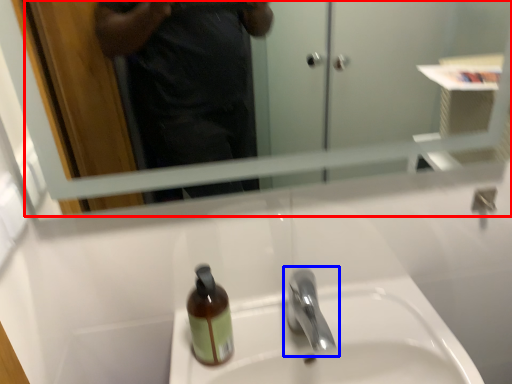
Question: Which point is further to the camera, mirror (highlighted by a red box) or tap (highlighted by a blue box)?

Choices:
 (A) mirror
 (B) tap

Answer: (B)